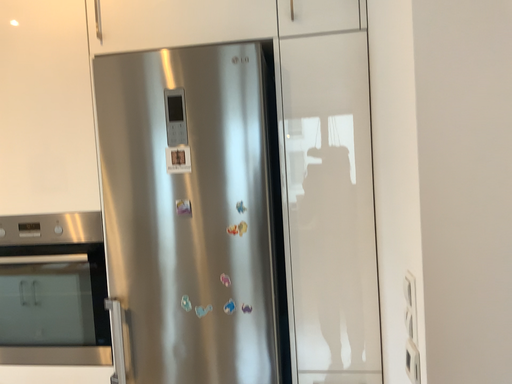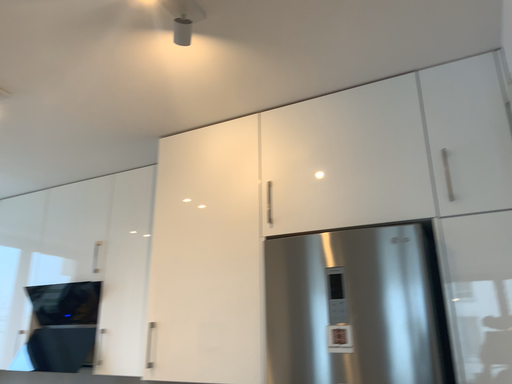
Question: How did the camera likely rotate when shooting the video?

Choices:
 (A) rotated upward
 (B) rotated downward

Answer: (A)